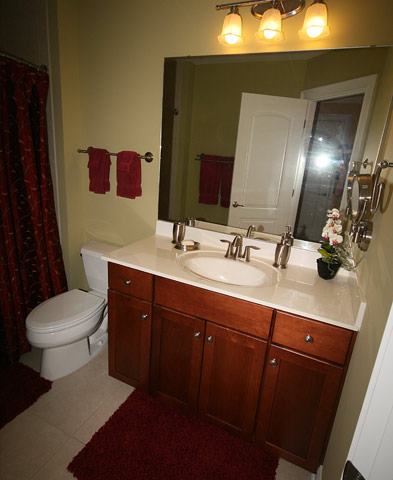
Where is `towels`? The height and width of the screenshot is (480, 393). towels is located at coordinates (116, 179).